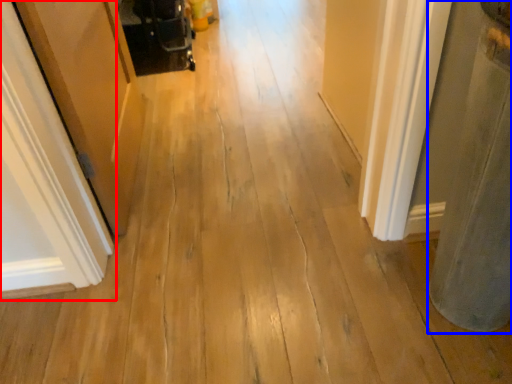
Question: Among these objects, which one is farthest to the camera, door (highlighted by a red box) or pillar (highlighted by a blue box)?

Choices:
 (A) door
 (B) pillar

Answer: (A)